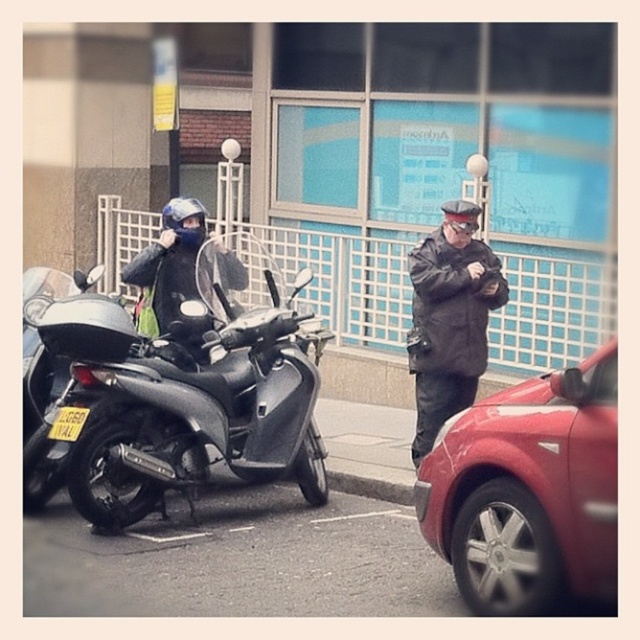
You are a pedestrian trying to cross the street and see the matte black scooter at left and the black leather jacket at center. Which object is closer to you?

The matte black scooter at left is closer to you because it is in front of the black leather jacket at center.

You are a pedestrian standing in the middle of the street. You see the matte black scooter at left and the metallic red car at right. Which object is closer to your current position?

The matte black scooter at left is closer to your current position because it is positioned over the metallic red car at right, indicating it is in front of the car and thus nearer to you as a pedestrian in the middle of the street.

You are standing at the center of the image and want to locate the point at coordinates point (529,492). Which object is this point located on?

The point (529,492) is located on the metallic red car at right.